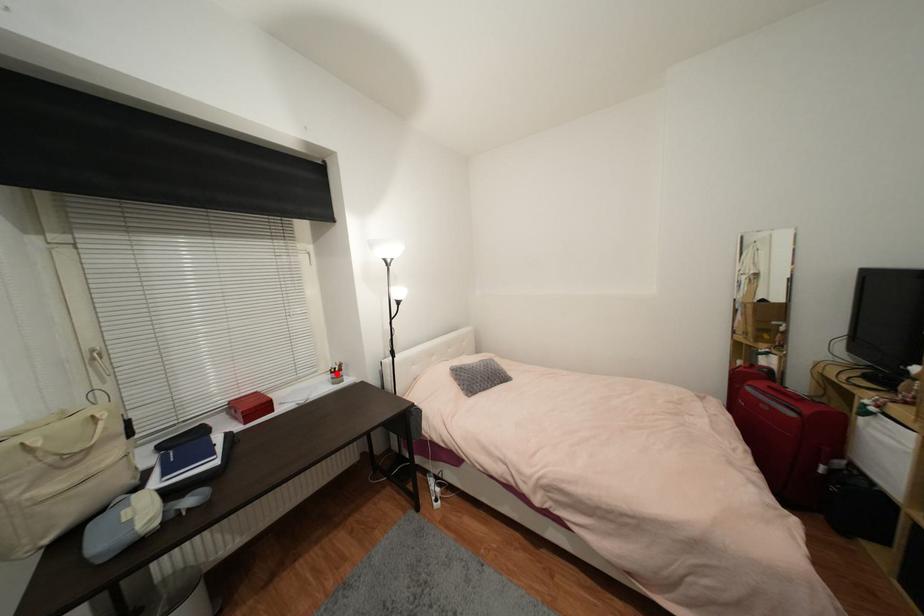
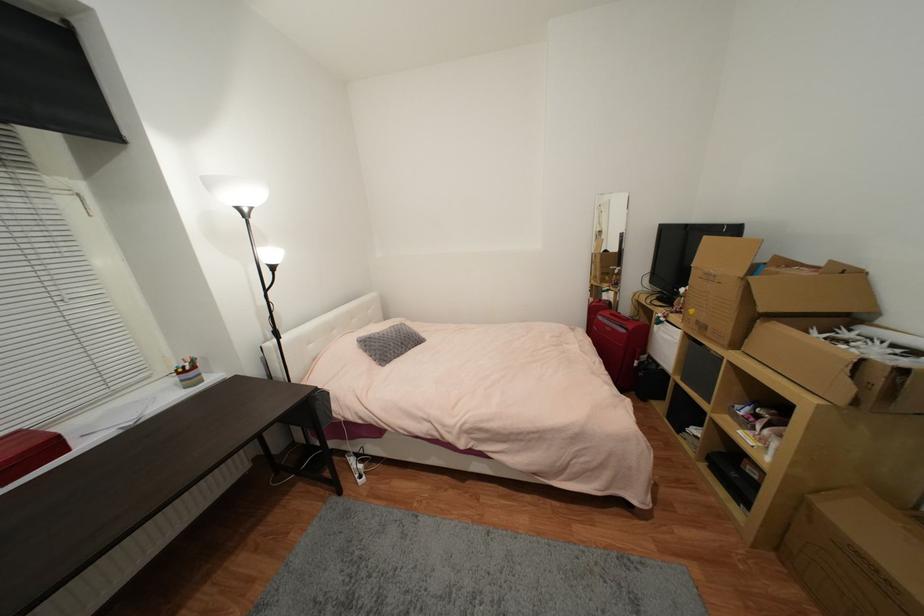
Locate, in the second image, the point that corresponds to the highlighted location in the first image.

(185, 374)